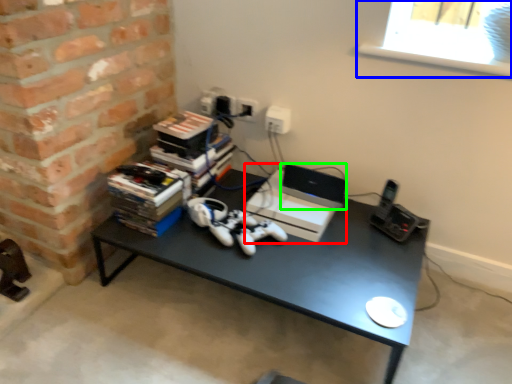
Question: Considering the real-world distances, which object is farthest from computer (highlighted by a red box)? window screen (highlighted by a blue box) or laptop (highlighted by a green box)?

Choices:
 (A) window screen
 (B) laptop

Answer: (A)